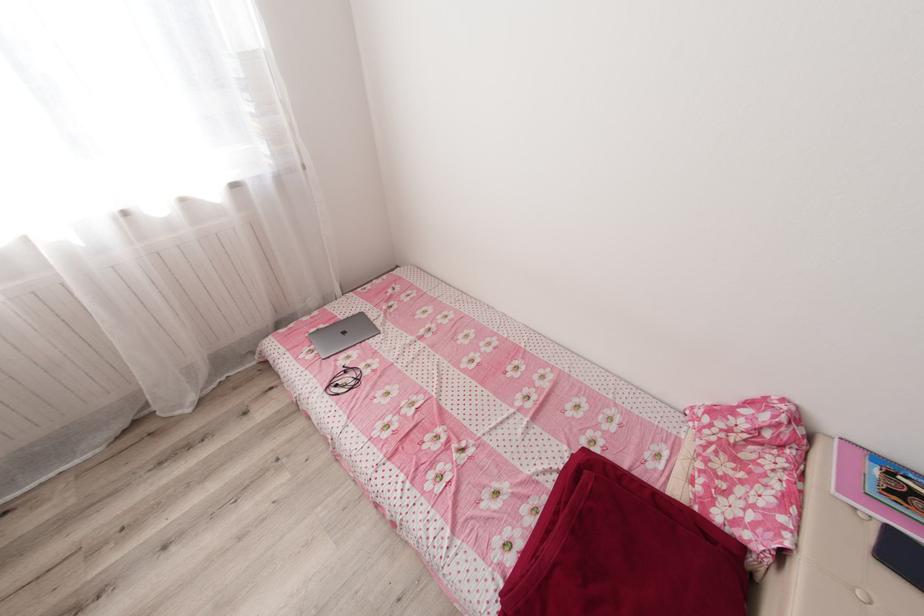
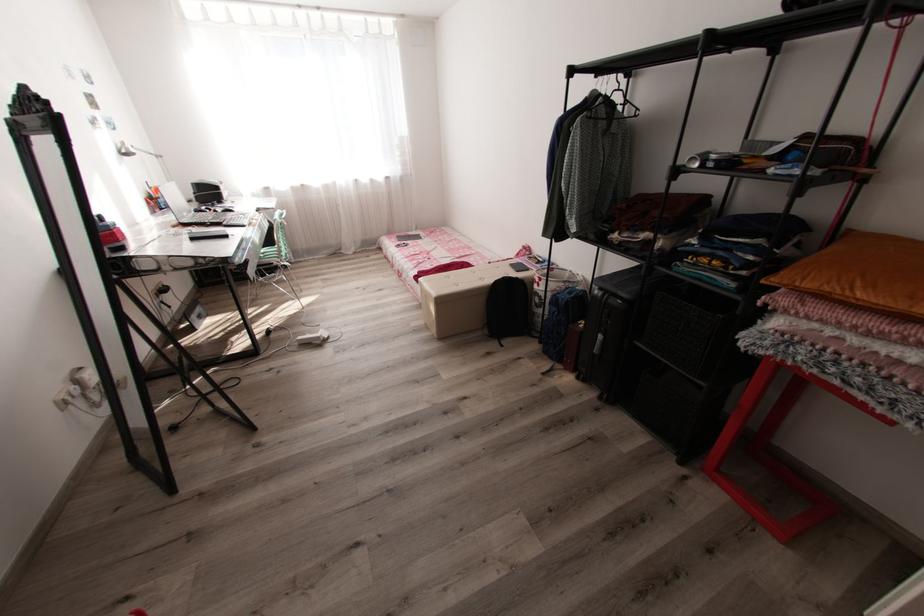
The point at (502, 493) is marked in the first image. Where is the corresponding point in the second image?

(436, 265)